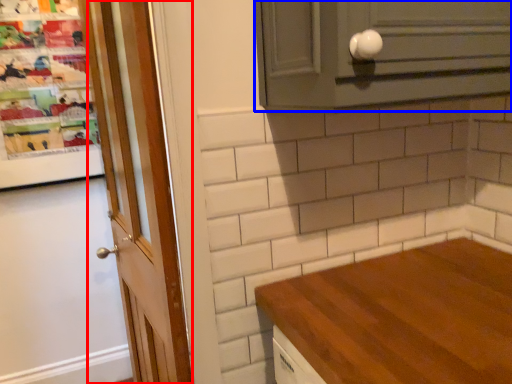
Question: Which object is closer to the camera taking this photo, door (highlighted by a red box) or cabinetry (highlighted by a blue box)?

Choices:
 (A) door
 (B) cabinetry

Answer: (B)